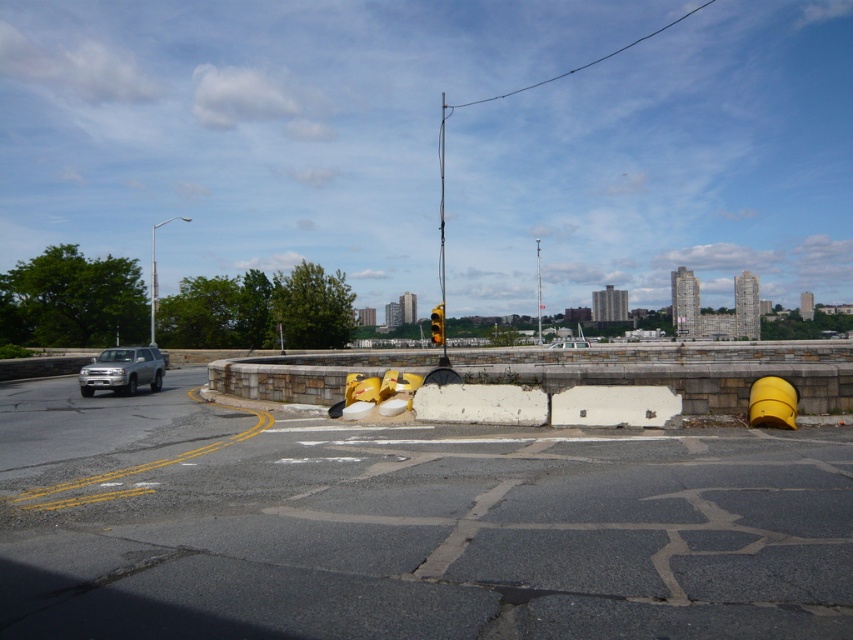
Does asphalt at center have a greater width compared to silver metallic suv at left?

Correct, the width of asphalt at center exceeds that of silver metallic suv at left.

Which of these two, asphalt at center or silver metallic suv at left, stands shorter?

With less height is asphalt at center.

Is point (227, 476) more distant than point (138, 380)?

No.

This screenshot has height=640, width=853. Identify the location of asphalt at center. (408, 525).

In the scene shown: Between metallic traffic light at center and yellow matte traffic light at center, which one has less height?

yellow matte traffic light at center

Which is in front, point (444, 284) or point (440, 314)?

Point (440, 314)

This screenshot has height=640, width=853. I want to click on metallic traffic light at center, so click(440, 198).

Is silver metallic suv at left thinner than yellow matte traffic light at center?

No.

Does point (140, 371) lie in front of point (437, 317)?

No.

Which is behind, point (137, 356) or point (430, 328)?

Point (430, 328)

This screenshot has height=640, width=853. Identify the location of silver metallic suv at left. (122, 371).